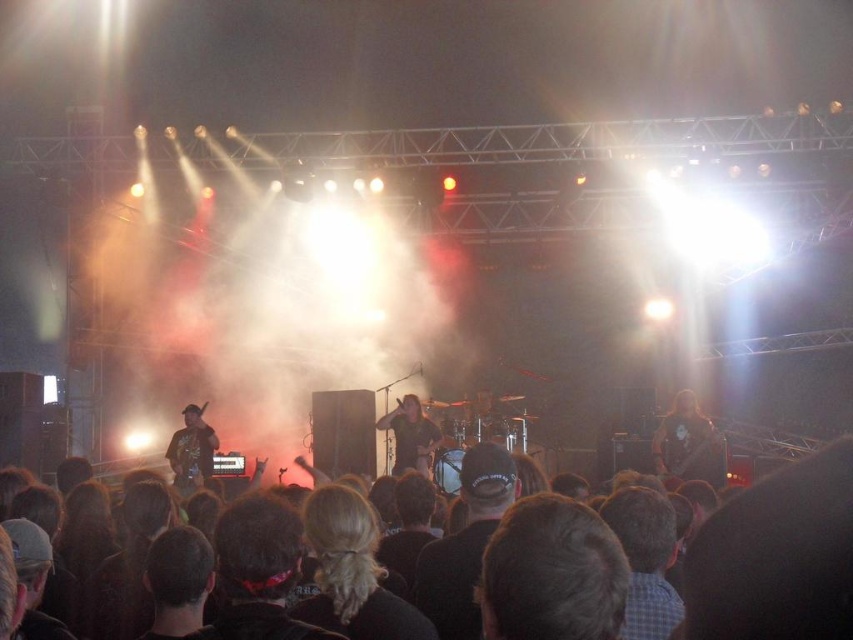
Question: Which point is closer to the camera?

Choices:
 (A) green fabric guitar at left
 (B) dark brown leather guitar at center

Answer: (A)

Question: Can you confirm if dark brown leather guitar at center is thinner than shiny black guitar at center?

Choices:
 (A) no
 (B) yes

Answer: (A)

Question: Is dark brown hair at center below dark brown leather guitar at center?

Choices:
 (A) no
 (B) yes

Answer: (A)

Question: Can you confirm if dark brown hair at center is positioned to the left of shiny black guitar at center?

Choices:
 (A) no
 (B) yes

Answer: (A)

Question: Which object is farther from the camera taking this photo?

Choices:
 (A) dark brown leather guitar at center
 (B) shiny black guitar at center
 (C) green fabric guitar at left
 (D) dark brown hair at center

Answer: (B)

Question: Among these objects, which one is farthest from the camera?

Choices:
 (A) dark brown leather guitar at center
 (B) shiny black guitar at center
 (C) dark brown hair at center
 (D) green fabric guitar at left

Answer: (B)